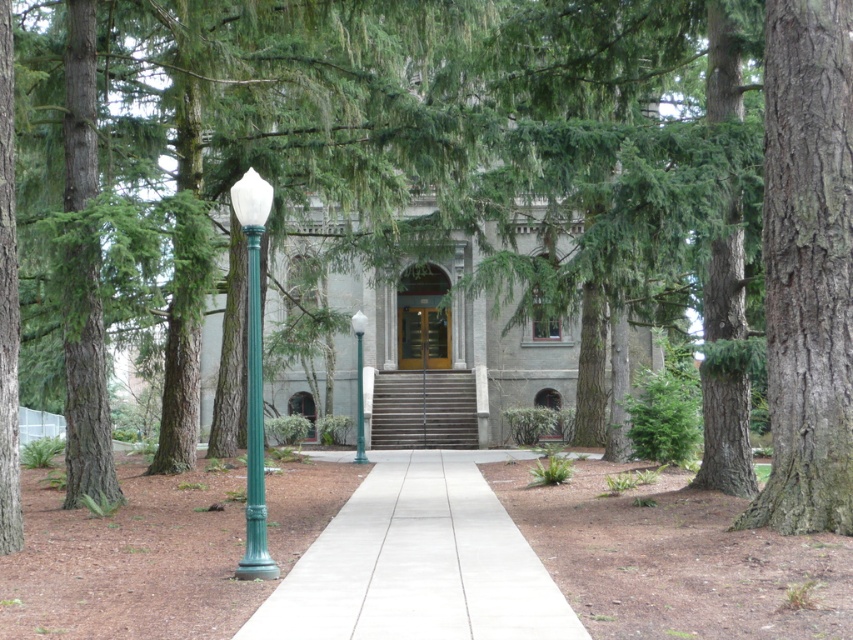
Is the position of smooth bark tree at right more distant than that of concrete at center?

That is True.

Does smooth bark tree at right have a lesser height compared to concrete at center?

Incorrect, smooth bark tree at right's height does not fall short of concrete at center's.

Is point (838, 528) positioned behind point (498, 552)?

That is False.

Find the location of `smooth bark tree at right`. smooth bark tree at right is located at coordinates (807, 266).

Who is taller, concrete at center or green glass pole at center?

Standing taller between the two is green glass pole at center.

Between point (287, 572) and point (360, 332), which one is positioned in front?

Point (287, 572) is in front.

This screenshot has height=640, width=853. Find the location of `concrete at center`. concrete at center is located at coordinates (418, 563).

Can you confirm if concrete at center is positioned to the left of green matte lamp post at center?

A: No, concrete at center is not to the left of green matte lamp post at center.

At what (x,y) coordinates should I click in order to perform the action: click on concrete at center. Please return your answer as a coordinate pair (x, y). Image resolution: width=853 pixels, height=640 pixels. Looking at the image, I should click on (418, 563).

Is point (376, 497) positioned before point (248, 225)?

No, it is not.

This screenshot has width=853, height=640. In order to click on concrete at center in this screenshot , I will do `click(418, 563)`.